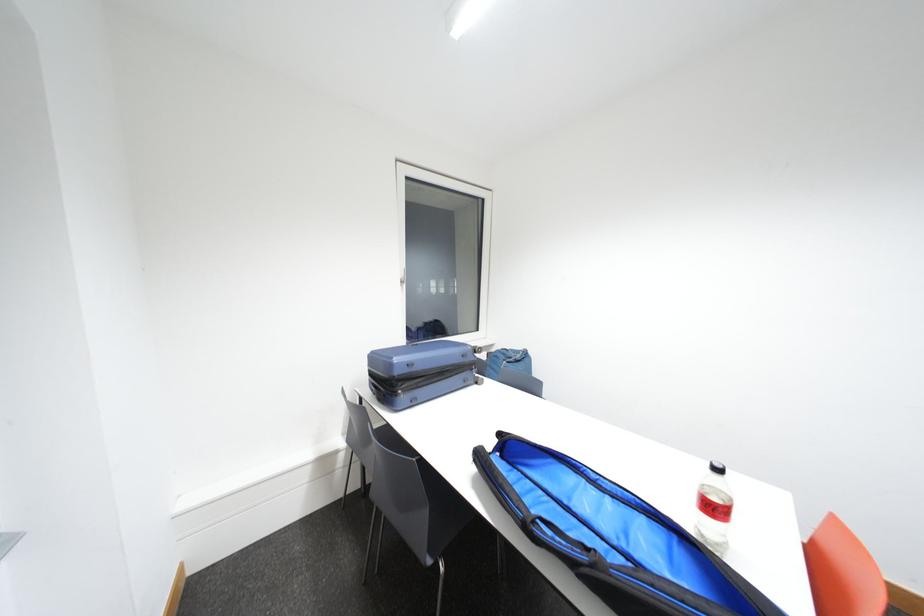
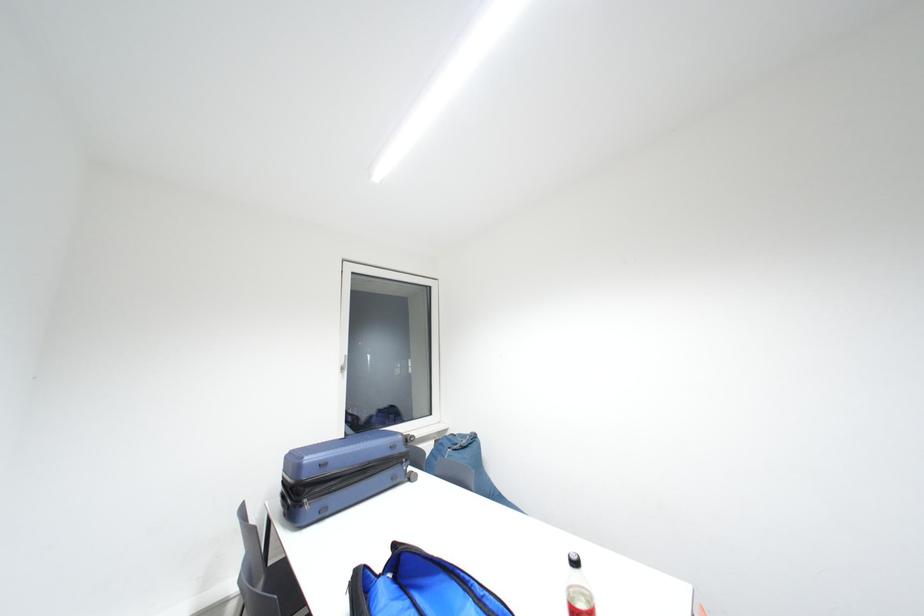
Question: In a continuous first-person perspective shot, in which direction is the camera moving?

Choices:
 (A) Left
 (B) Right
 (C) Forward
 (D) Backward

Answer: (B)